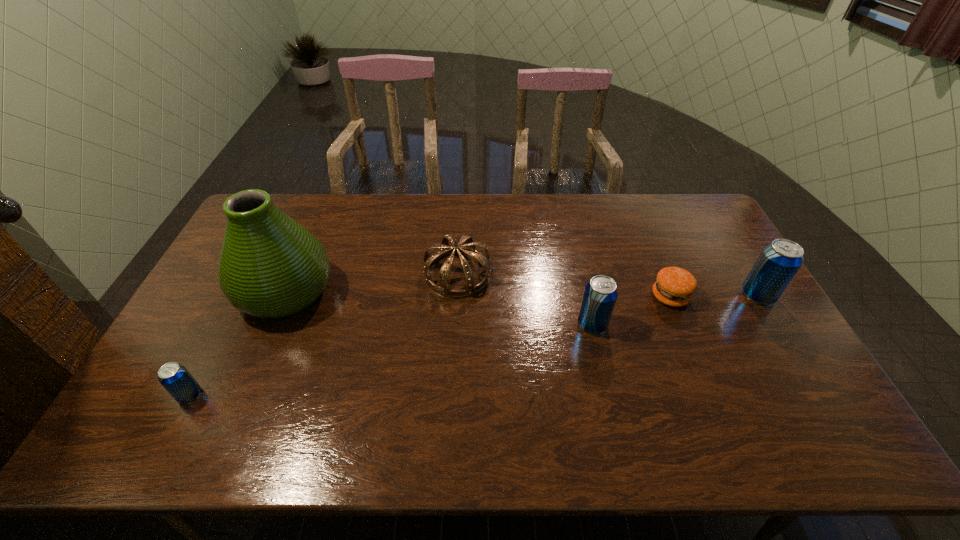
At what (x,y) coordinates should I click in order to perform the action: click on the shortest beer can. Please return your answer as a coordinate pair (x, y). Image resolution: width=960 pixels, height=540 pixels. Looking at the image, I should click on (174, 377).

Locate an element on the screen. The height and width of the screenshot is (540, 960). the nearest object is located at coordinates (174, 377).

Find the location of a particular element. This screenshot has width=960, height=540. the fourth object from left to right is located at coordinates (600, 294).

Where is `the second shortest beer can`? the second shortest beer can is located at coordinates (600, 294).

Where is `the farthest beer can`? The image size is (960, 540). the farthest beer can is located at coordinates tap(779, 261).

You are a GUI agent. You are given a task and a screenshot of the screen. Output one action in this format:
    pyautogui.click(x=<x>, y=<y>)
    Task: Click on the rightmost beer can
    
    Given the screenshot: What is the action you would take?
    pyautogui.click(x=779, y=261)

Locate an element on the screen. The image size is (960, 540). the tallest object is located at coordinates (270, 266).

You are a GUI agent. You are given a task and a screenshot of the screen. Output one action in this format:
    pyautogui.click(x=<x>, y=<y>)
    Task: Click on the tiara
    The height and width of the screenshot is (540, 960).
    Given the screenshot: What is the action you would take?
    pyautogui.click(x=442, y=287)

This screenshot has width=960, height=540. In order to click on the fifth object from left to right in this screenshot , I will do `click(674, 286)`.

This screenshot has width=960, height=540. Identify the location of patty. (674, 286).